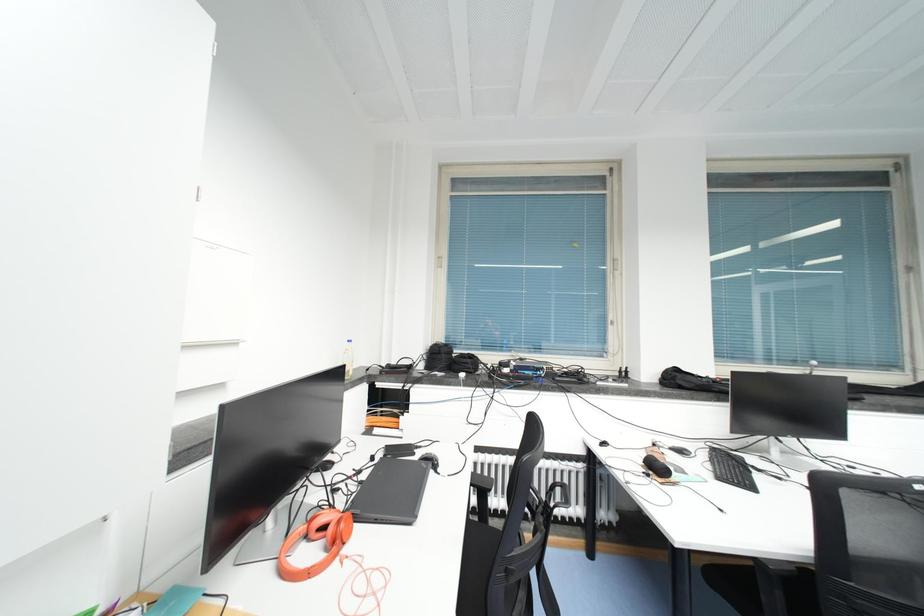
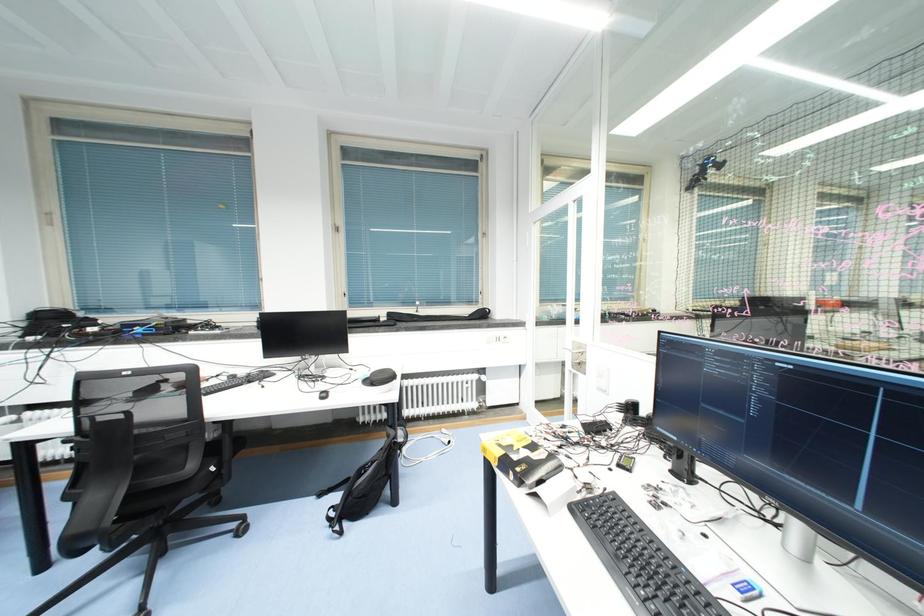
Question: The images are taken continuously from a first-person perspective. In which direction are you moving?

Choices:
 (A) Left
 (B) Right
 (C) Forward
 (D) Backward

Answer: (B)